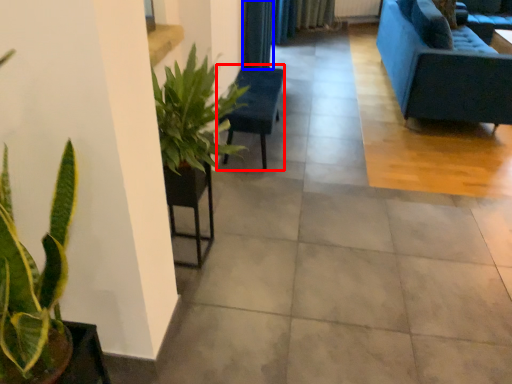
Question: Which of the following is the closest to the observer, armchair (highlighted by a red box) or curtain (highlighted by a blue box)?

Choices:
 (A) armchair
 (B) curtain

Answer: (A)